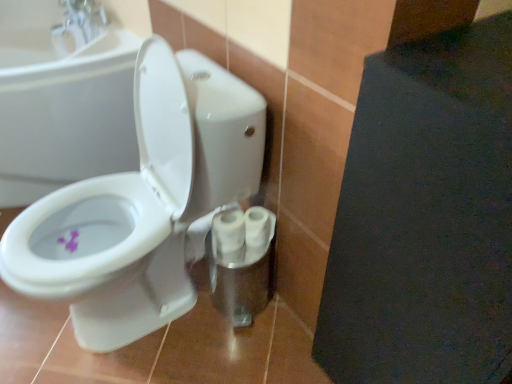
Question: From the image's perspective, is white glossy toilet at center positioned above or below white glossy toilet paper at center, acting as the 2th toilet paper starting from the right?

Choices:
 (A) above
 (B) below

Answer: (A)

Question: From a real-world perspective, is white glossy toilet at center physically located above or below white glossy toilet paper at center, acting as the 2th toilet paper starting from the right?

Choices:
 (A) below
 (B) above

Answer: (B)

Question: Which of these objects is positioned closest to the white glossy toilet at center?

Choices:
 (A) white glossy toilet at center left
 (B) white glossy toilet paper at center, acting as the 2th toilet paper starting from the right
 (C) purple matte flower at lower left
 (D) white matte toilet paper at lower center, the first toilet paper positioned from the right
 (E) white glossy sink at upper left

Answer: (B)

Question: Considering the real-world distances, which object is farthest from the white matte toilet paper at lower center, the second toilet paper positioned from the left?

Choices:
 (A) white glossy sink at upper left
 (B) white glossy toilet at center left
 (C) white glossy toilet paper at center, acting as the 2th toilet paper starting from the right
 (D) purple matte flower at lower left
 (E) white glossy toilet at center

Answer: (A)